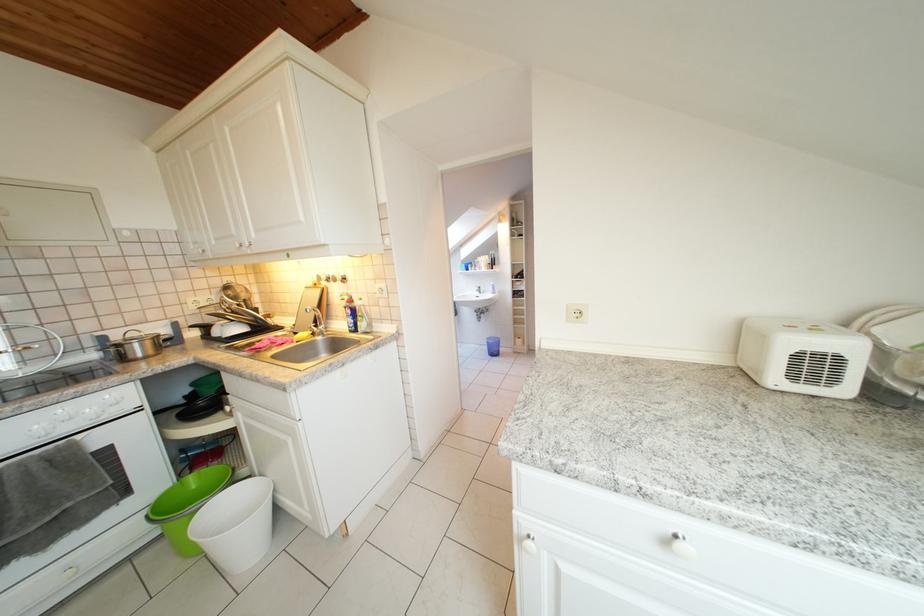
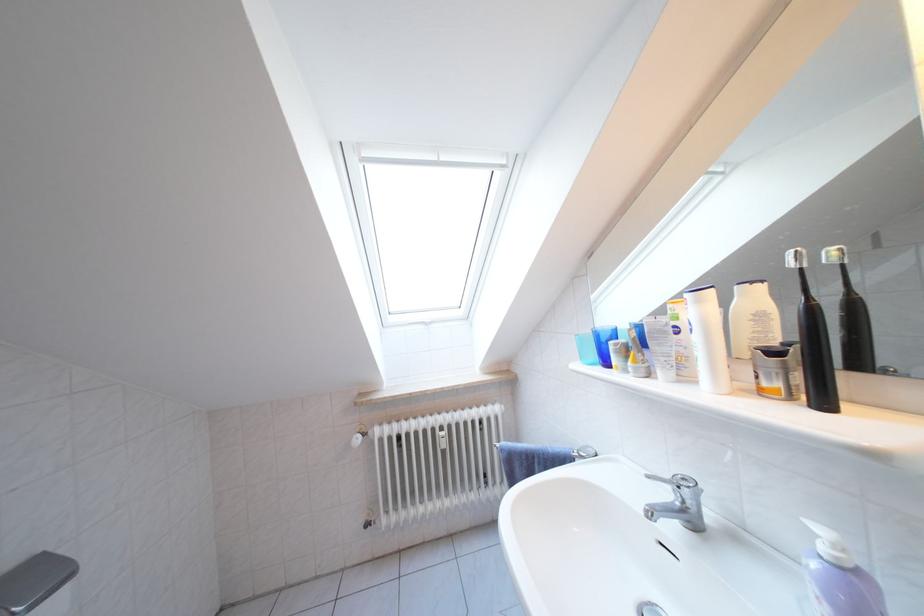
Find the pixel in the second image that matches point 485,294 in the first image.

(675, 500)